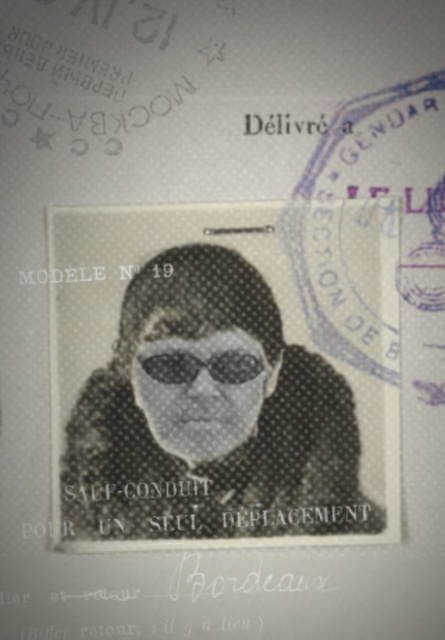
Question: Is black textured hair at center to the left of black matte goggles at center from the viewer's perspective?

Choices:
 (A) yes
 (B) no

Answer: (B)

Question: Among these points, which one is farthest from the camera?

Choices:
 (A) pyautogui.click(x=238, y=378)
 (B) pyautogui.click(x=132, y=396)

Answer: (A)

Question: Which point is farther from the camera taking this photo?

Choices:
 (A) (76, 408)
 (B) (222, 380)

Answer: (B)

Question: Does black textured hair at center have a larger size compared to black matte goggles at center?

Choices:
 (A) yes
 (B) no

Answer: (A)

Question: Where is black textured hair at center located in relation to black matte goggles at center in the image?

Choices:
 (A) right
 (B) left

Answer: (A)